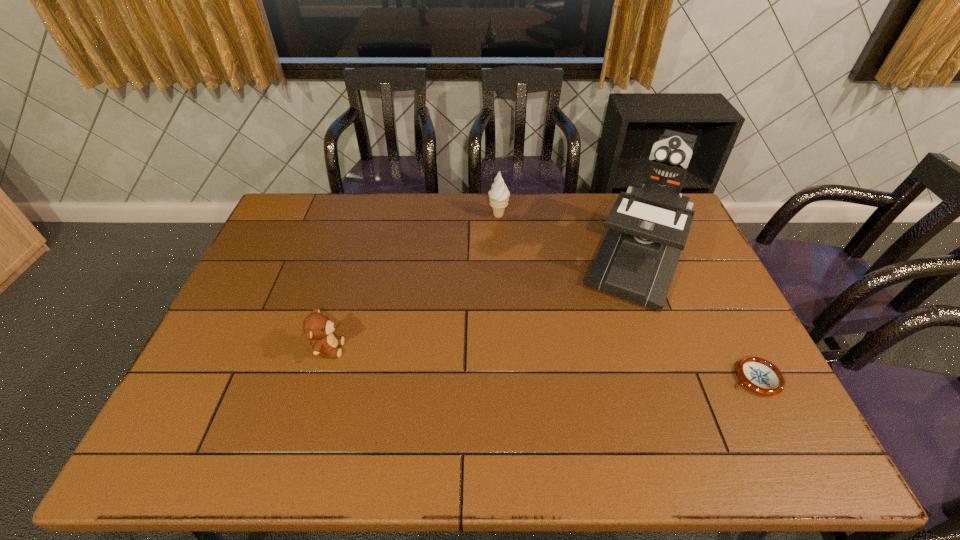
I want to click on object present at the near right corner, so click(x=759, y=375).

The image size is (960, 540). In the image, there is a desktop. What are the coordinates of `vacant space at the far edge` in the screenshot? It's located at (402, 204).

The image size is (960, 540). I want to click on free region at the left edge of the desktop, so click(269, 245).

This screenshot has height=540, width=960. Find the location of `vacant space at the right edge of the desktop`. vacant space at the right edge of the desktop is located at coordinates (680, 268).

In the image, there is a desktop. Identify the location of free space at the far left corner. The height and width of the screenshot is (540, 960). (284, 217).

Where is `free space between the microscope and the third tallest object`? This screenshot has height=540, width=960. free space between the microscope and the third tallest object is located at coordinates (483, 305).

Locate an element on the screen. This screenshot has width=960, height=540. empty space that is in between the leftmost object and the third object from right to left is located at coordinates (414, 282).

Where is `blank region between the second tallest object and the second shortest object`? blank region between the second tallest object and the second shortest object is located at coordinates (414, 282).

Locate an element on the screen. free space between the leftmost object and the tallest object is located at coordinates (483, 305).

The width and height of the screenshot is (960, 540). I want to click on blank region between the third shortest object and the tallest object, so click(567, 238).